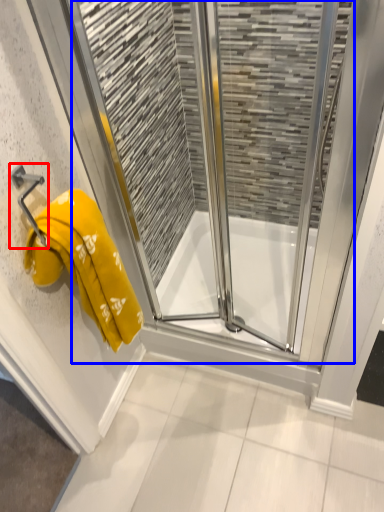
Question: Which of the following is the farthest to the observer, towel bar (highlighted by a red box) or screen door (highlighted by a blue box)?

Choices:
 (A) towel bar
 (B) screen door

Answer: (A)